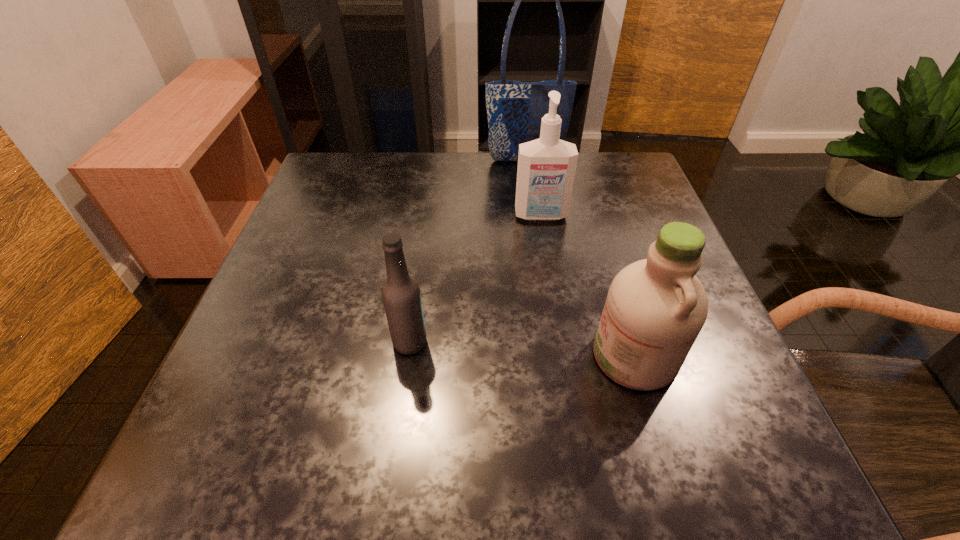
Where is `vacant area that lies between the shopping bag and the leftmost object`? The width and height of the screenshot is (960, 540). vacant area that lies between the shopping bag and the leftmost object is located at coordinates (x=468, y=252).

This screenshot has width=960, height=540. I want to click on vacant point located between the shopping bag and the leftmost object, so click(468, 252).

I want to click on vacant point located between the leftmost object and the nearer cleansing agent, so click(522, 349).

This screenshot has height=540, width=960. I want to click on vacant area between the leftmost object and the nearer cleansing agent, so click(x=522, y=349).

At what (x,y) coordinates should I click in order to perform the action: click on empty space between the nearer cleansing agent and the shopping bag. Please return your answer as a coordinate pair (x, y). This screenshot has width=960, height=540. Looking at the image, I should click on coord(580,258).

Locate an element on the screen. The width and height of the screenshot is (960, 540). free space between the second farthest object and the nearer cleansing agent is located at coordinates (588, 286).

Locate an element on the screen. The width and height of the screenshot is (960, 540). the third closest object to the tallest object is located at coordinates point(401,295).

Choose which object is the second nearest neighbor to the nearer cleansing agent. Please provide its 2D coordinates. Your answer should be formatted as a tuple, i.e. [(x, y)], where the tuple contains the x and y coordinates of a point satisfying the conditions above.

[(401, 295)]

Image resolution: width=960 pixels, height=540 pixels. I want to click on vacant space that satisfies the following two spatial constraints: 1. on the front label of the farther cleansing agent; 2. on the label of the leftmost object, so click(x=561, y=342).

You are a GUI agent. You are given a task and a screenshot of the screen. Output one action in this format:
    pyautogui.click(x=<x>, y=<y>)
    Task: Click on the vacant region that satisfies the following two spatial constraints: 1. on the front label of the farther cleansing agent; 2. on the label of the leftmost object
    This screenshot has height=540, width=960.
    Given the screenshot: What is the action you would take?
    pyautogui.click(x=561, y=342)